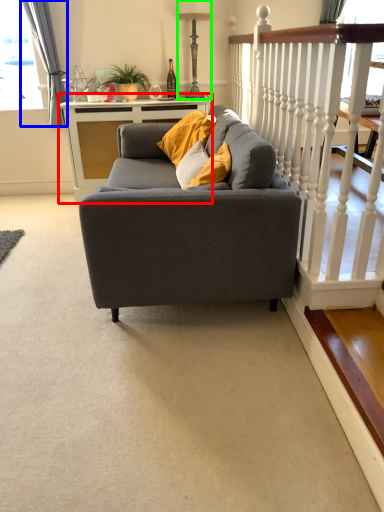
Question: Which object is positioned closest to table (highlighted by a red box)? Select from curtain (highlighted by a blue box) and lamp (highlighted by a green box).

Choices:
 (A) curtain
 (B) lamp

Answer: (A)